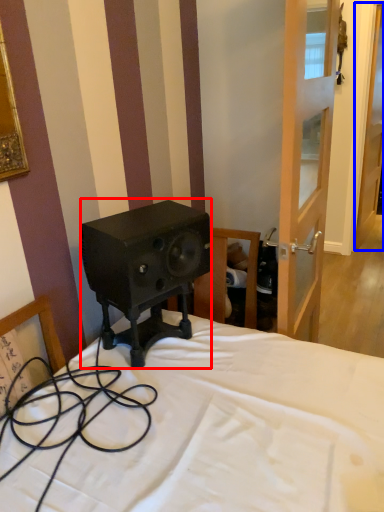
Question: Among these objects, which one is nearest to the camera, loudspeaker (highlighted by a red box) or door (highlighted by a blue box)?

Choices:
 (A) loudspeaker
 (B) door

Answer: (A)